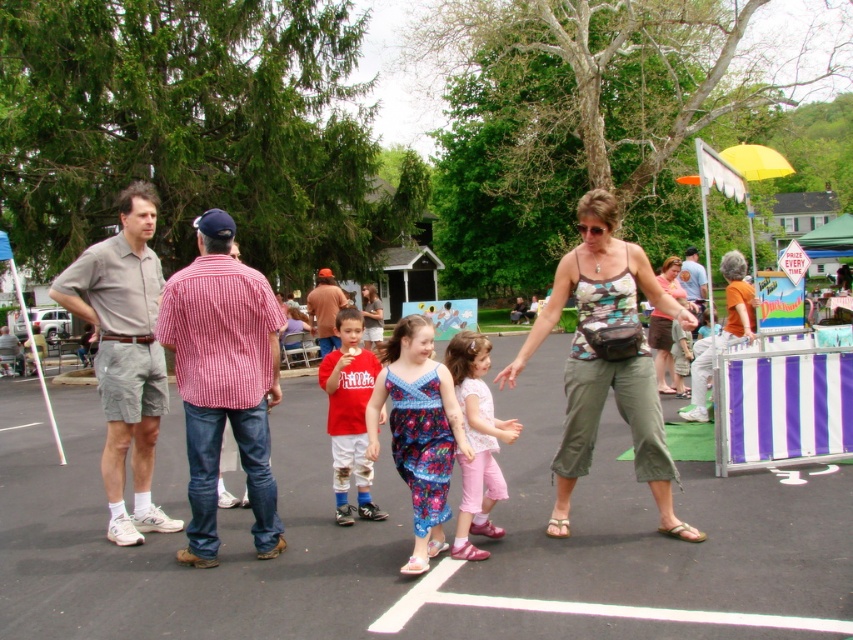
Question: Can you confirm if matte red t-shirt at center is bigger than brown plaid shirt at center?

Choices:
 (A) yes
 (B) no

Answer: (B)

Question: Does red checkered shirt at left come behind gray cotton shirt at left?

Choices:
 (A) yes
 (B) no

Answer: (B)

Question: Among these points, which one is nearest to the camera?

Choices:
 (A) [x=317, y=289]
 (B) [x=376, y=509]
 (C) [x=607, y=257]

Answer: (C)

Question: Can you confirm if gray cotton shirt at left is positioned to the left of brown plaid shirt at center?

Choices:
 (A) yes
 (B) no

Answer: (A)

Question: Which object appears closest to the camera in this image?

Choices:
 (A) floral fabric dress at center
 (B) gray cotton shirt at left
 (C) brown plaid shirt at center

Answer: (A)

Question: Which object appears farthest from the camera in this image?

Choices:
 (A) pink fabric dress at center
 (B) red plaid shirt at center
 (C) floral fabric dress at center
 (D) red checkered shirt at left

Answer: (B)